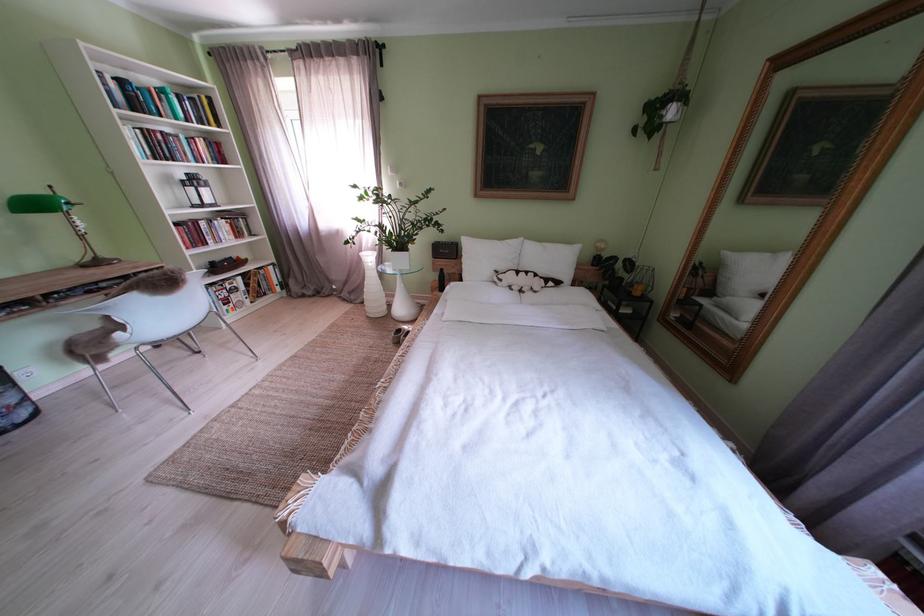
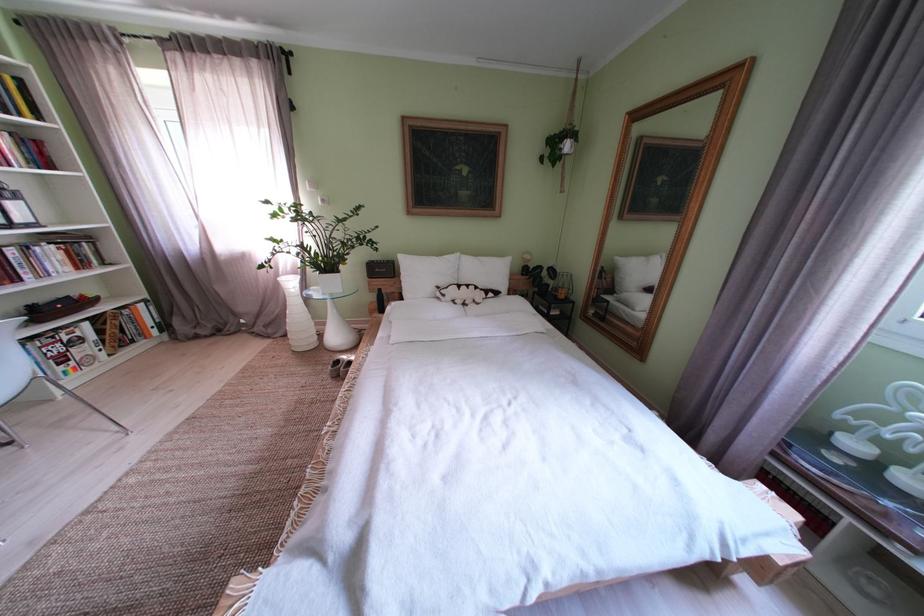
Question: The camera is either moving clockwise (left) or counter-clockwise (right) around the object. The first image is from the beginning of the video and the second image is from the end. Is the camera moving left or right when shooting the video?

Choices:
 (A) Left
 (B) Right

Answer: (A)